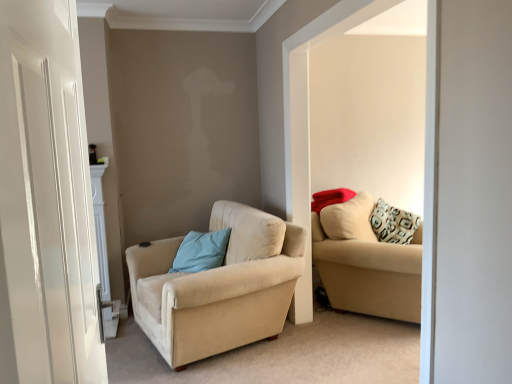
Question: In terms of width, does light blue fabric pillow at center-left look wider or thinner when compared to white glossy door at left?

Choices:
 (A) thin
 (B) wide

Answer: (B)

Question: Considering the positions of light blue fabric pillow at center-left and white glossy door at left in the image, is light blue fabric pillow at center-left taller or shorter than white glossy door at left?

Choices:
 (A) short
 (B) tall

Answer: (A)

Question: Which object is the farthest from the white glossy door at left?

Choices:
 (A) light blue fabric pillow at center-left
 (B) beige fabric armchair at left, acting as the 1th studio couch starting from the left
 (C) beige fabric couch at right, the first studio couch from the right
 (D) beige fabric couch at right

Answer: (D)

Question: Estimate the real-world distances between objects in this image. Which object is closer to the beige fabric armchair at left, acting as the 1th studio couch starting from the left?

Choices:
 (A) beige fabric couch at right, the first studio couch from the right
 (B) white glossy door at left
 (C) light blue fabric pillow at center-left
 (D) beige fabric couch at right

Answer: (C)